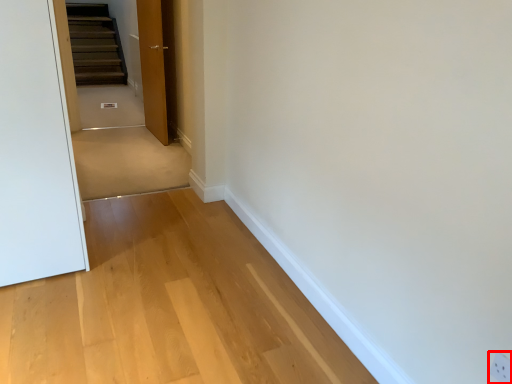
Question: From the image, what is the correct spatial relationship of electric outlet (annotated by the red box) in relation to door?

Choices:
 (A) left
 (B) right

Answer: (B)